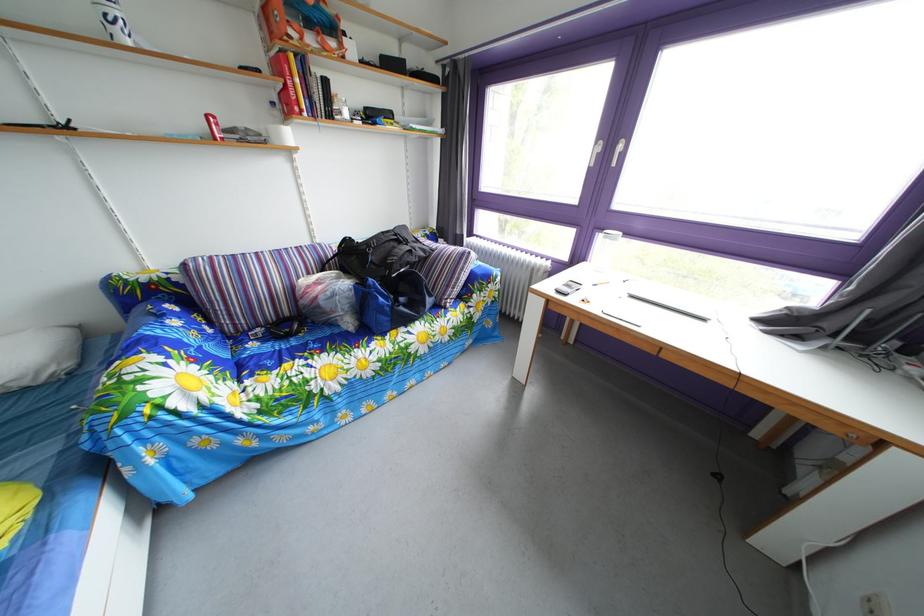
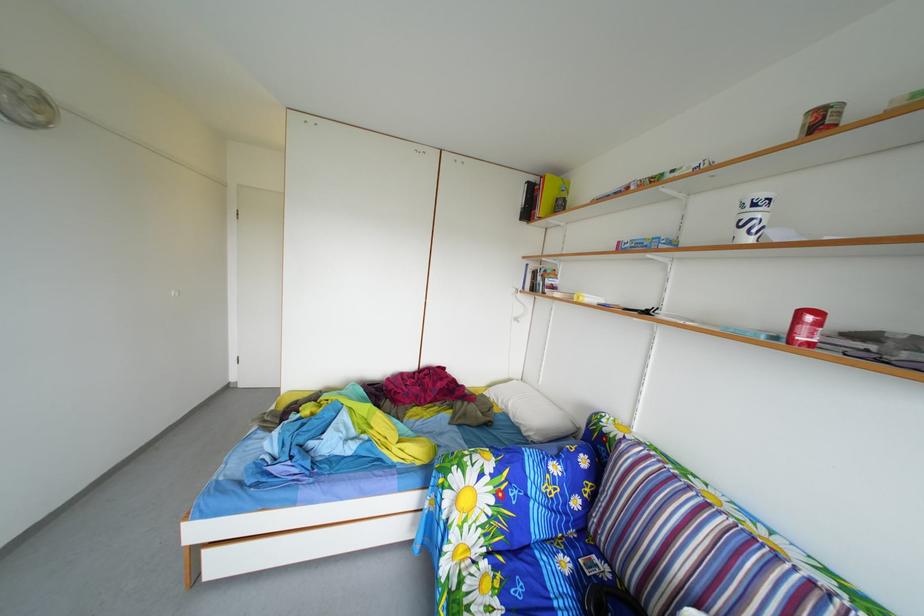
Locate, in the second image, the point that corresponds to pixel 217 124 in the first image.

(811, 321)